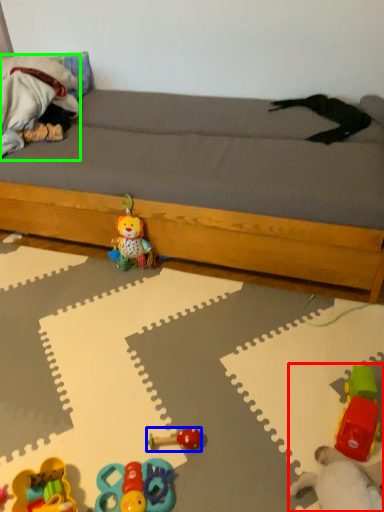
Question: Considering the real-world distances, which object is closest to toy (highlighted by a red box)? toy (highlighted by a blue box) or animal (highlighted by a green box).

Choices:
 (A) toy
 (B) animal

Answer: (A)